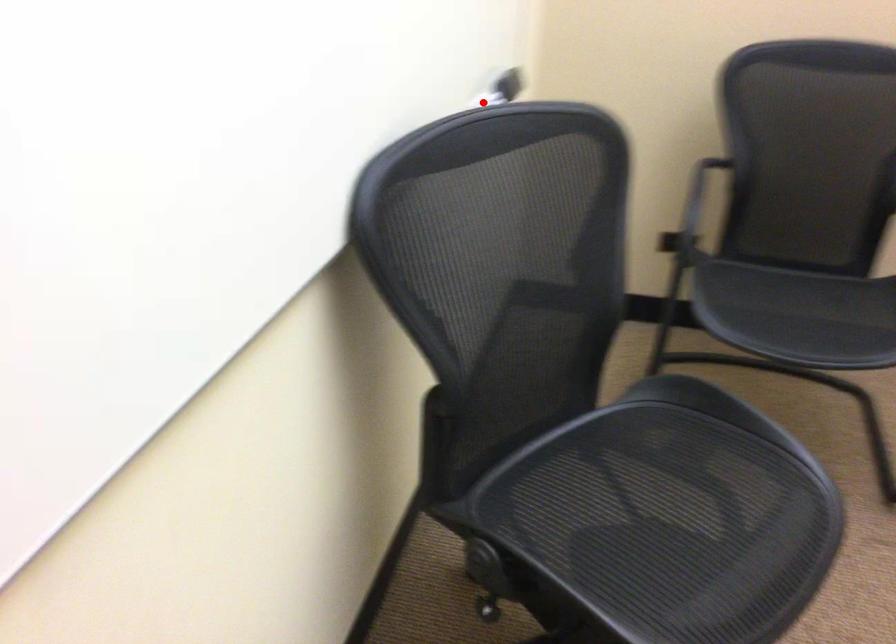
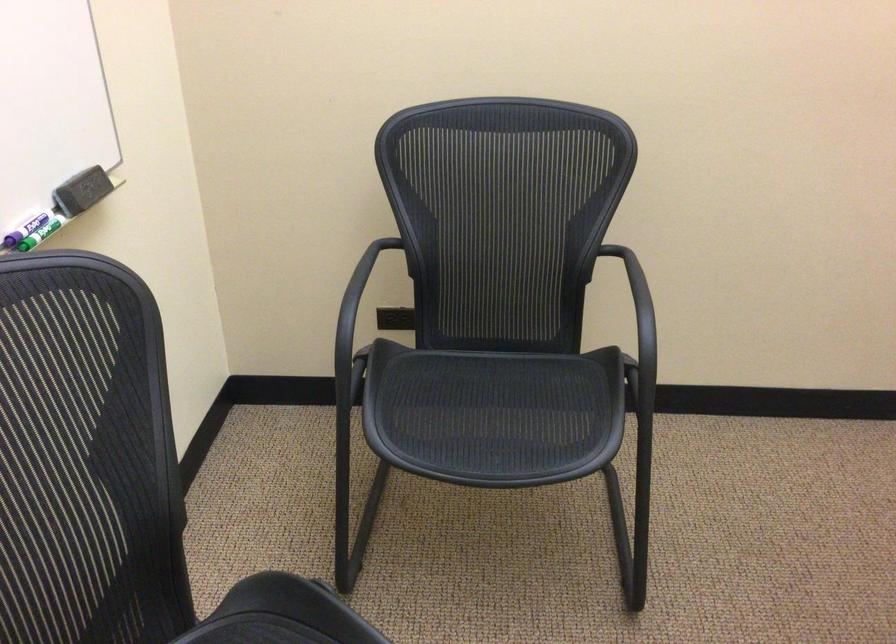
Question: A red point is marked in image1. In image2, is the corresponding 3D point closer to the camera or farther? Reply with the corresponding letter.

Choices:
 (A) The corresponding 3D point is closer.
 (B) The corresponding 3D point is farther.

Answer: (A)